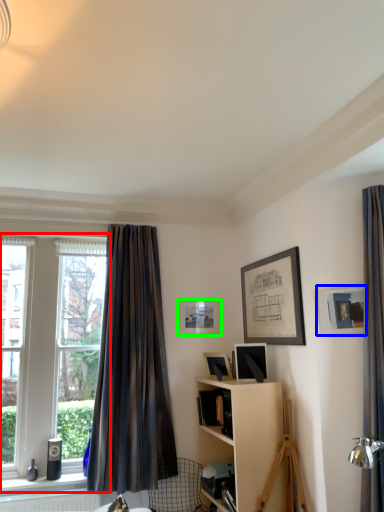
Question: Considering the real-world distances, which object is closest to window (highlighted by a red box)? picture frame (highlighted by a blue box) or picture frame (highlighted by a green box).

Choices:
 (A) picture frame
 (B) picture frame

Answer: (B)